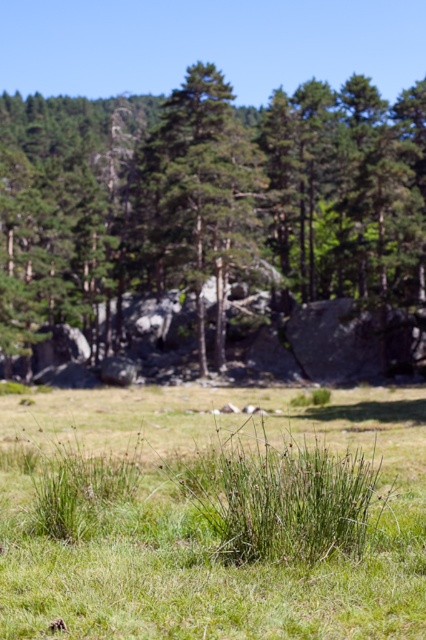
You are a hiker standing at the edge of the forest looking at the green leafy tree at center and the green grass at center. You want to place a 50 meter long rope between them. Will the rope be long enough?

The green leafy tree at center and green grass at center are 49.27 meters apart. The rope is 50 meters long, so it will be long enough to span the distance between them.

You are a hiker standing in the middle of a grassy field and want to take a photo of the green leafy tree at center and the green grass at center. Which object will appear bigger in your camera viewfinder?

The green leafy tree at center will appear bigger in the camera viewfinder because it has a larger size compared to the green grass at center.

You are standing in the middle of the forest and see the green leafy tree at center and the green grass at center. Which one is closer to you?

The green leafy tree at center is closer to you because the green grass at center is behind it.